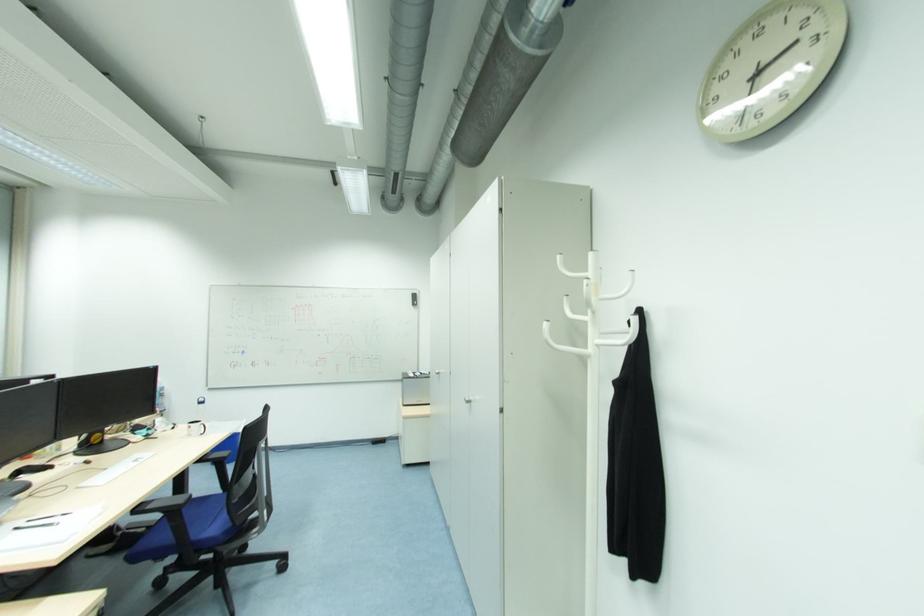
The width and height of the screenshot is (924, 616). Describe the element at coordinates (201, 513) in the screenshot. I see `the blue chair seat` at that location.